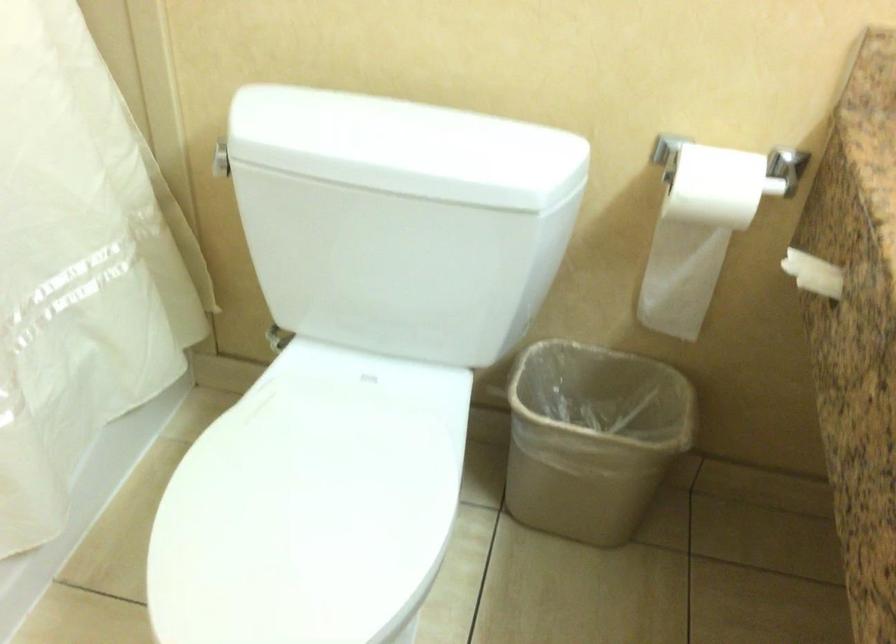
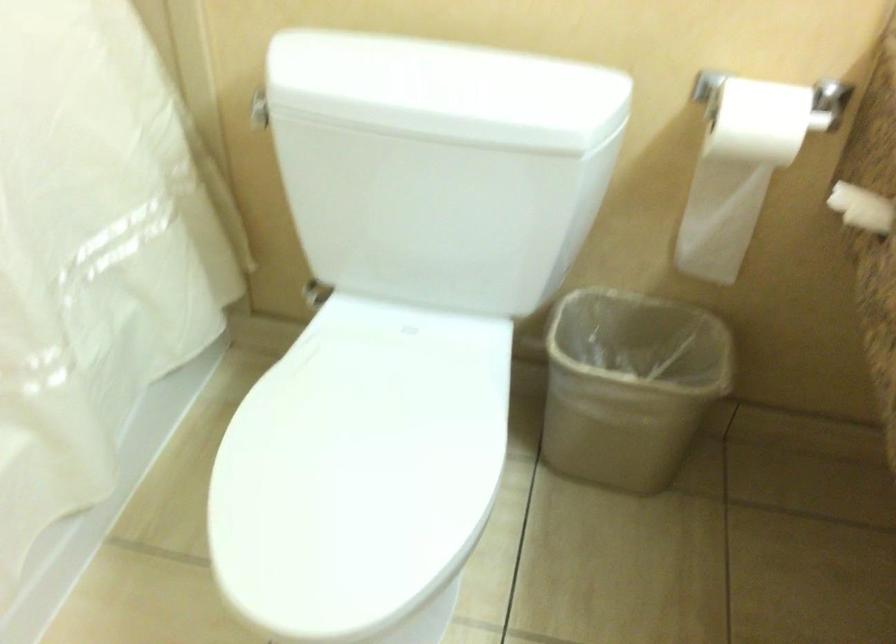
Locate, in the second image, the point that corresponds to point 589,440 in the first image.

(629, 384)